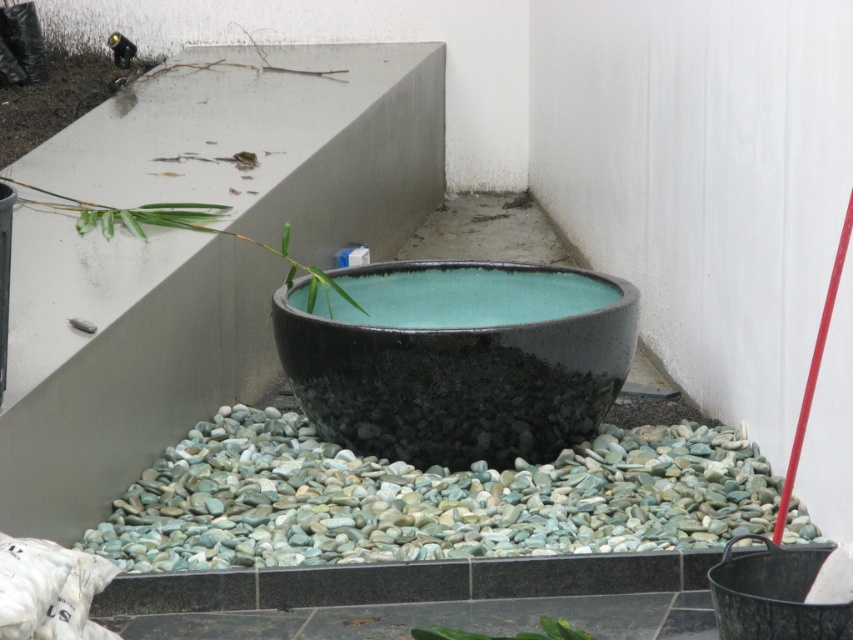
From the picture: Measure the distance between black glossy bowl at center and green leafy plant at upper left.

black glossy bowl at center is 1.11 meters from green leafy plant at upper left.

The height and width of the screenshot is (640, 853). What do you see at coordinates (456, 371) in the screenshot?
I see `black glossy bowl at center` at bounding box center [456, 371].

Between point (321, 362) and point (206, 230), which one is positioned in front?

Point (321, 362) is more forward.

You are a GUI agent. You are given a task and a screenshot of the screen. Output one action in this format:
    pyautogui.click(x=<x>, y=<y>)
    Task: Click on the black glossy bowl at center
    
    Given the screenshot: What is the action you would take?
    pyautogui.click(x=456, y=371)

Can you confirm if black glossy bowl at center is shorter than green leafy plant at center?

No.

Who is lower down, black glossy bowl at center or green leafy plant at center?

Positioned lower is green leafy plant at center.

The image size is (853, 640). Describe the element at coordinates (456, 371) in the screenshot. I see `black glossy bowl at center` at that location.

At what (x,y) coordinates should I click in order to perform the action: click on black glossy bowl at center. Please return your answer as a coordinate pair (x, y). The height and width of the screenshot is (640, 853). Looking at the image, I should click on (456, 371).

Between green leafy plant at upper left and green leafy plant at center, which one is positioned higher?

Positioned higher is green leafy plant at upper left.

Is the position of green leafy plant at upper left less distant than that of green leafy plant at center?

No.

Is point (204, 228) farther from camera compared to point (561, 625)?

Yes, it is behind point (561, 625).

Where is `green leafy plant at upper left`? This screenshot has height=640, width=853. green leafy plant at upper left is located at coordinates (189, 228).